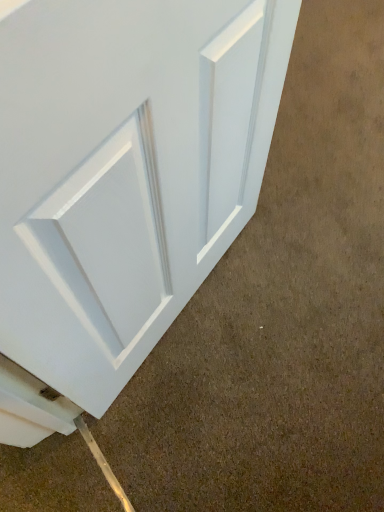
This screenshot has width=384, height=512. In order to click on white matte door at lower left in this screenshot , I will do coord(125,170).

What do you see at coordinates (125, 170) in the screenshot? I see `white matte door at lower left` at bounding box center [125, 170].

Where is `white matte door at lower left`? The width and height of the screenshot is (384, 512). white matte door at lower left is located at coordinates (125, 170).